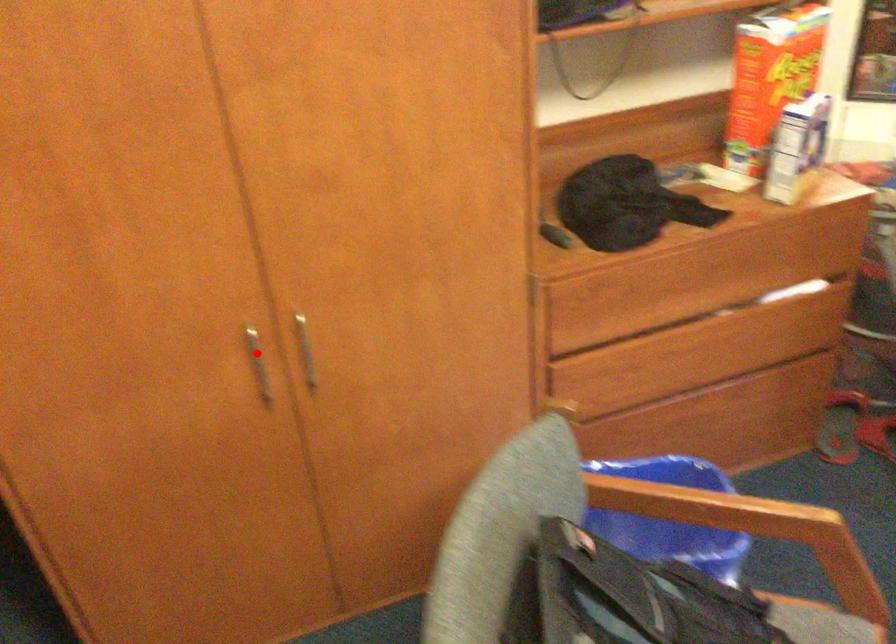
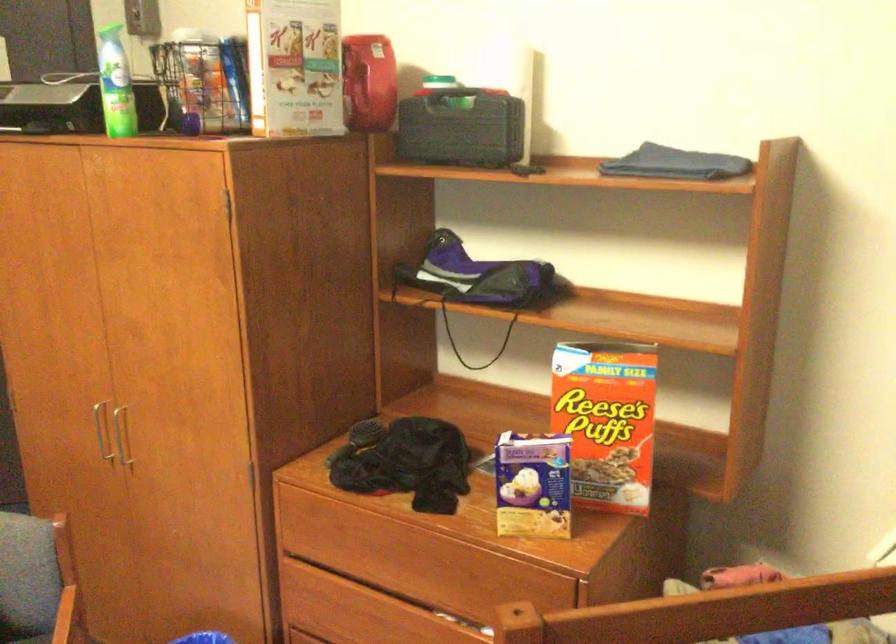
Question: I am providing you with two images of the same scene from different viewpoints. In image1, a red point is highlighted. Considering the same 3D point in image2, which of the following is correct?

Choices:
 (A) It is closer
 (B) It is farther

Answer: (B)